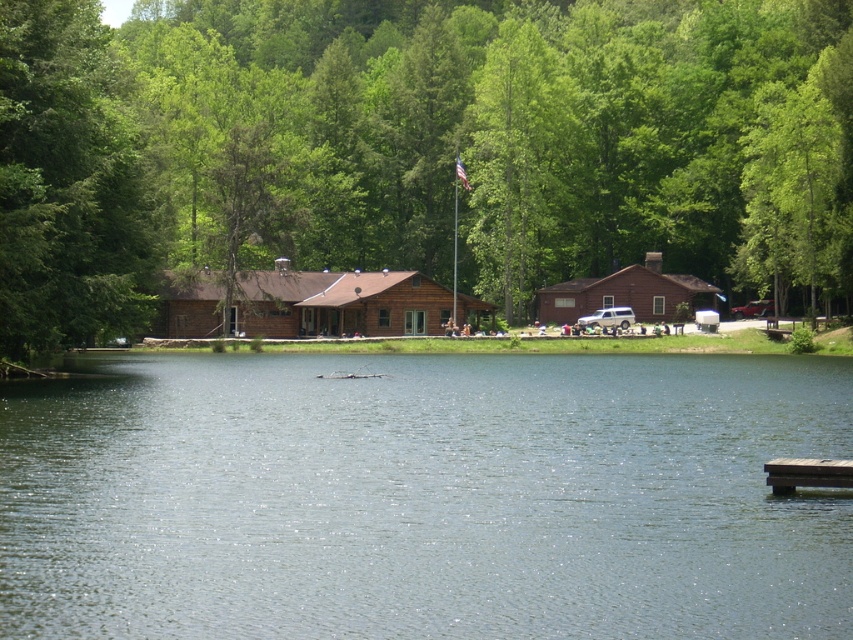
Can you confirm if clear water at center is thinner than brown wooden cabin at center?

No.

Which is in front, point (494, 579) or point (195, 294)?

Point (494, 579)

Between point (456, 522) and point (283, 266), which one is positioned behind?

The point (283, 266) is behind.

The width and height of the screenshot is (853, 640). Find the location of `clear water at center`. clear water at center is located at coordinates (424, 497).

Can you confirm if brown wood cabin at center is thinner than brown wooden dock at lower right?

In fact, brown wood cabin at center might be wider than brown wooden dock at lower right.

Find the location of a particular element. brown wood cabin at center is located at coordinates (625, 292).

How far apart are green leafy tree at upper center and brown wooden cabin at center?

A distance of 18.34 meters exists between green leafy tree at upper center and brown wooden cabin at center.

Can you confirm if green leafy tree at upper center is wider than brown wooden cabin at center?

Indeed, green leafy tree at upper center has a greater width compared to brown wooden cabin at center.

Between point (144, 209) and point (215, 304), which one is positioned behind?

Point (215, 304)

Where is `green leafy tree at upper center`? The image size is (853, 640). green leafy tree at upper center is located at coordinates (416, 147).